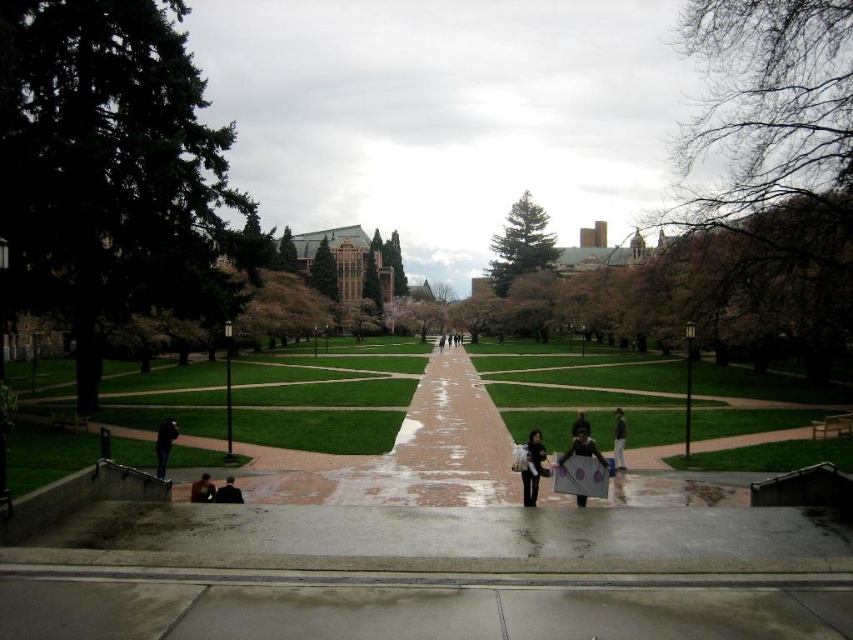
You are standing at the starting point of the pathway in the foreground. You see two points marked on the image, point 1 at coordinates point (535, 476) and point 2 at coordinates point (618, 440). If you walk towards the central building, which point will you encounter first?

Point 1 at coordinates point (535, 476) will be encountered first because it is in front of point 2 at coordinates point (618, 440) along the pathway towards the central building.

You are a student walking along the pathway in the campus scene. You see a matte gray paper at center and a dark blue jacket at lower left. Which object is larger in size?

The matte gray paper at center is bigger than the dark blue jacket at lower left according to the description.

You are a student carrying a dark blue jacket at lower left and need to place it on a matte gray paper at center. Given that you walk at 2 feet per second, how many seconds will it take you to reach the paper?

The distance between the matte gray paper at center and the dark blue jacket at lower left is 30.86 feet. At a walking speed of 2 feet per second, it would take approximately 15.43 seconds to reach the paper.